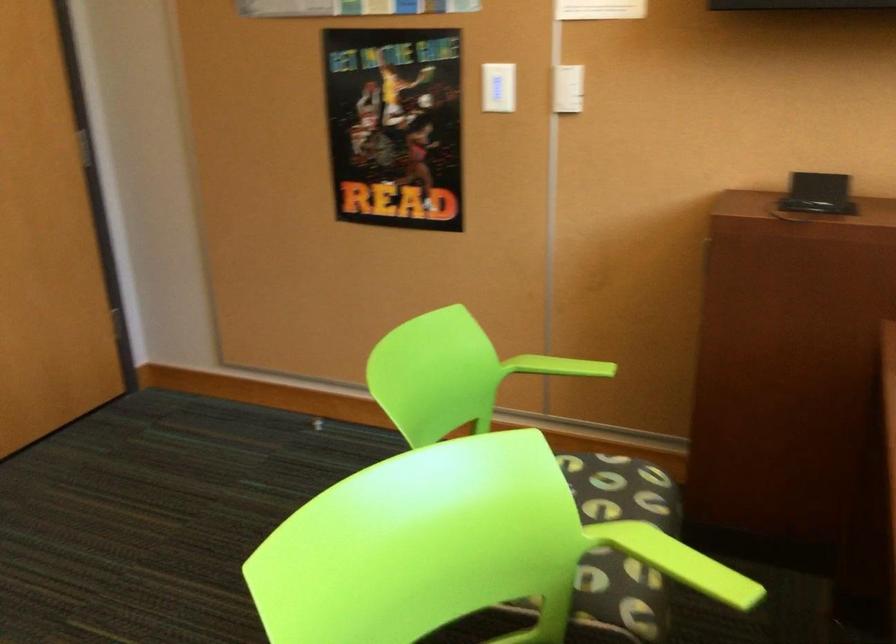
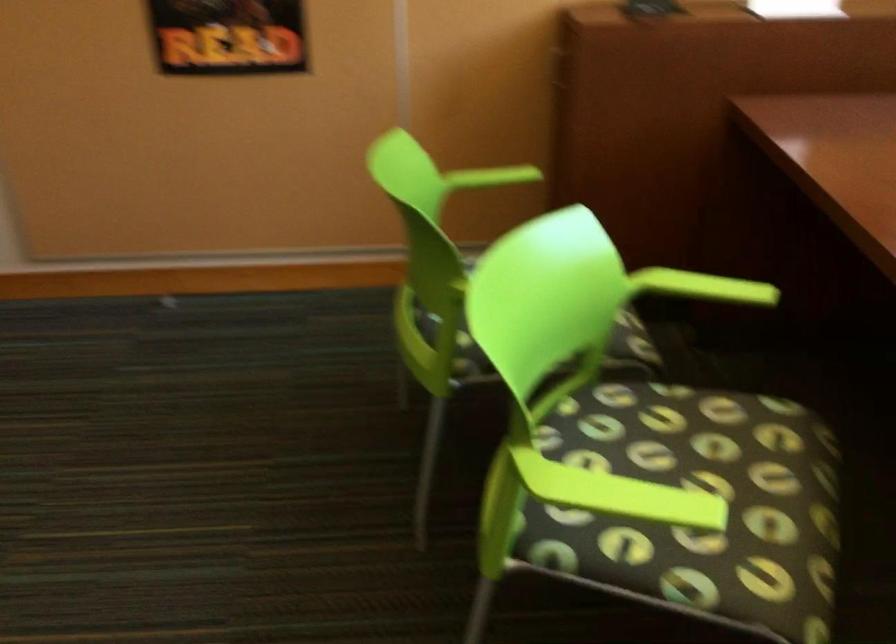
Question: What movement of the cameraman would produce the second image?

Choices:
 (A) Left
 (B) Right
 (C) Forward
 (D) Backward

Answer: (A)